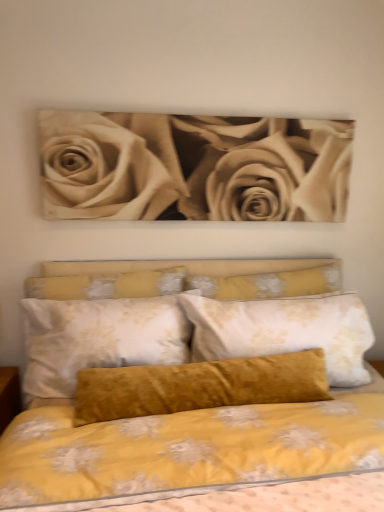
Question: Considering the relative sizes of sepia-toned roses at upper center and velvet mustard pillow at center in the image provided, is sepia-toned roses at upper center thinner than velvet mustard pillow at center?

Choices:
 (A) yes
 (B) no

Answer: (A)

Question: Can you confirm if sepia-toned roses at upper center is wider than velvet mustard pillow at center?

Choices:
 (A) no
 (B) yes

Answer: (A)

Question: Would you consider sepia-toned roses at upper center to be distant from velvet mustard pillow at center?

Choices:
 (A) yes
 (B) no

Answer: (B)

Question: Could you tell me if sepia-toned roses at upper center is facing velvet mustard pillow at center?

Choices:
 (A) yes
 (B) no

Answer: (B)

Question: Is sepia-toned roses at upper center taller than velvet mustard pillow at center?

Choices:
 (A) no
 (B) yes

Answer: (A)

Question: Does sepia-toned roses at upper center have a larger size compared to velvet mustard pillow at center?

Choices:
 (A) yes
 (B) no

Answer: (B)

Question: Considering the relative positions of sepia-toned roses at upper center and velvet yellow pillow at center in the image provided, is sepia-toned roses at upper center to the right of velvet yellow pillow at center from the viewer's perspective?

Choices:
 (A) no
 (B) yes

Answer: (A)

Question: Is sepia-toned roses at upper center wider than velvet yellow pillow at center?

Choices:
 (A) no
 (B) yes

Answer: (A)

Question: From a real-world perspective, does sepia-toned roses at upper center sit lower than velvet yellow pillow at center?

Choices:
 (A) yes
 (B) no

Answer: (B)

Question: From a real-world perspective, does sepia-toned roses at upper center stand above velvet yellow pillow at center?

Choices:
 (A) yes
 (B) no

Answer: (A)

Question: Is sepia-toned roses at upper center smaller than velvet yellow pillow at center?

Choices:
 (A) no
 (B) yes

Answer: (A)

Question: Is the position of sepia-toned roses at upper center more distant than that of velvet yellow pillow at center?

Choices:
 (A) yes
 (B) no

Answer: (B)

Question: Is sepia-toned roses at upper center at the back of velvet mustard pillow at center?

Choices:
 (A) yes
 (B) no

Answer: (B)